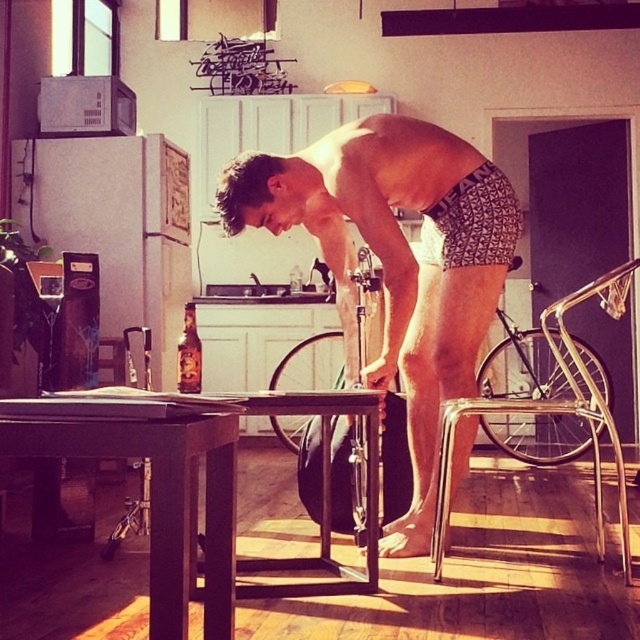
You are standing in the kitchen and see the dark wood table at center and the translucent glass bottle at center. Which object is positioned to the right of the other?

The dark wood table at center is to the right of the translucent glass bottle at center.

You are standing in the kitchen and see two points on the table. The first point is at coordinate point[429,500] and the second is at point[157,548]. Which point is closer to you?

Point[429,500] is further to the camera than point[157,548], so the second point is closer to you.